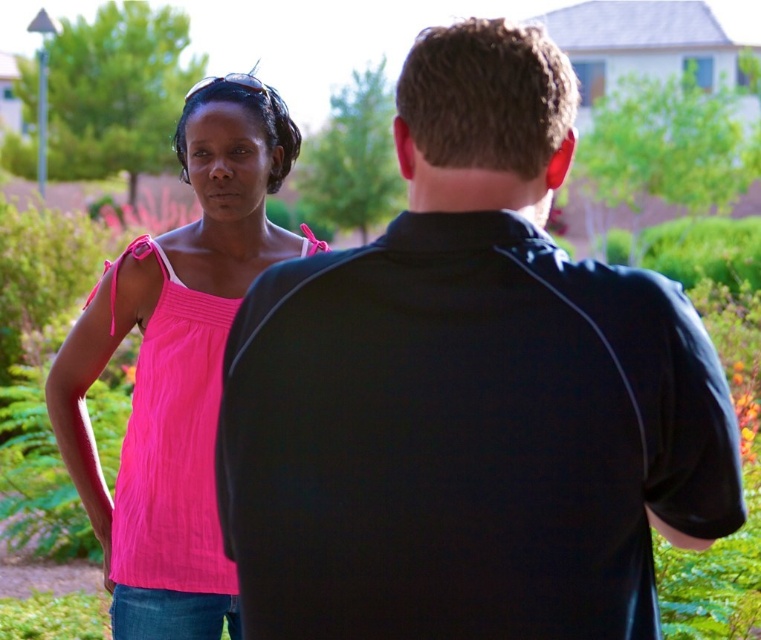
Question: Which object is positioned farthest from the pink fabric top at left?

Choices:
 (A) matte pink tank top at left
 (B) black matte shirt at center

Answer: (B)

Question: Is the position of pink fabric top at left less distant than that of matte pink tank top at left?

Choices:
 (A) yes
 (B) no

Answer: (A)

Question: Can you confirm if black matte shirt at center is positioned above matte pink tank top at left?

Choices:
 (A) yes
 (B) no

Answer: (A)

Question: Which point appears farthest from the camera in this image?

Choices:
 (A) (186, 432)
 (B) (463, 634)
 (C) (205, 400)

Answer: (C)

Question: Does pink fabric top at left appear on the left side of matte pink tank top at left?

Choices:
 (A) no
 (B) yes

Answer: (A)

Question: Based on their relative distances, which object is farther from the black matte shirt at center?

Choices:
 (A) pink fabric top at left
 (B) matte pink tank top at left

Answer: (B)